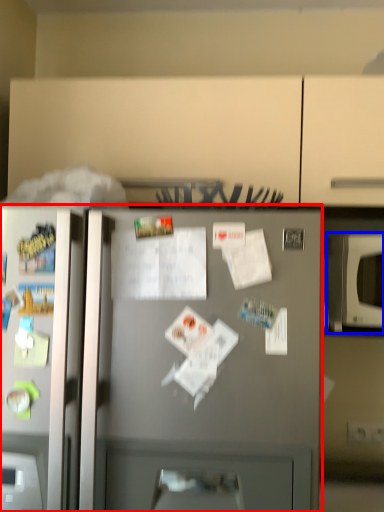
Question: Which object appears farthest to the camera in this image, refrigerator (highlighted by a red box) or microwave oven (highlighted by a blue box)?

Choices:
 (A) refrigerator
 (B) microwave oven

Answer: (B)